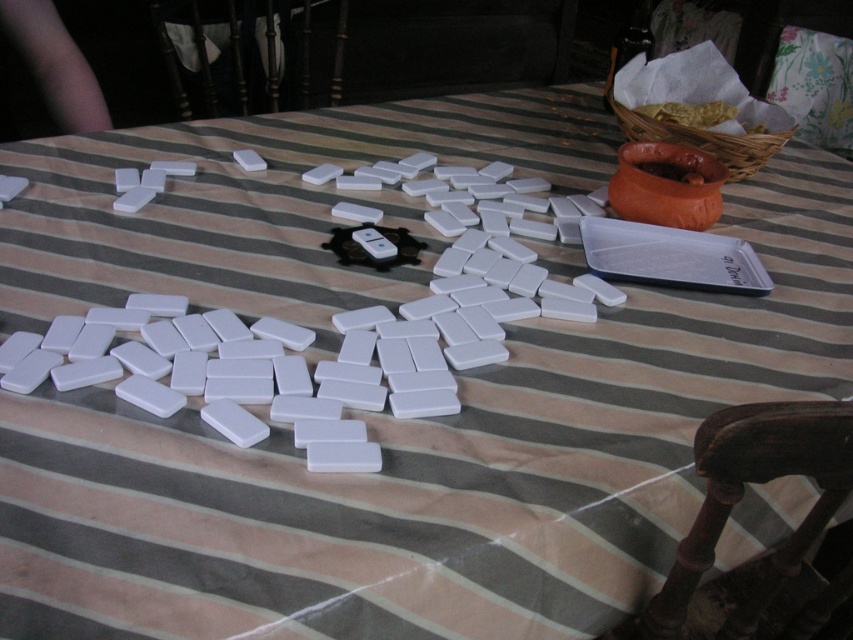
In the scene shown: You are sitting at the table and want to reach the brown wooden chair at lower right. Can you easily move around the white matte dominoes at center to get to it?

The brown wooden chair at lower right is behind the white matte dominoes at center, so you would need to move the dominoes out of the way or go around them to reach the chair.

Consider the image. You are a robot with a 40 cm wide arm. You need to reach the brown wooden chair at lower right from the white matte dominoes at center. Can your arm fit through the space between them?

The distance between the white matte dominoes at center and the brown wooden chair at lower right is 39.88 centimeters. Since your arm is 40 cm wide, it is slightly too wide to fit through the space between them.

You are sitting in the black metal chair at upper left and want to pick up the white matte dominoes at center. Which direction should you reach to grab them?

The white matte dominoes at center are below the black metal chair at upper left, so you should reach downward to grab them.